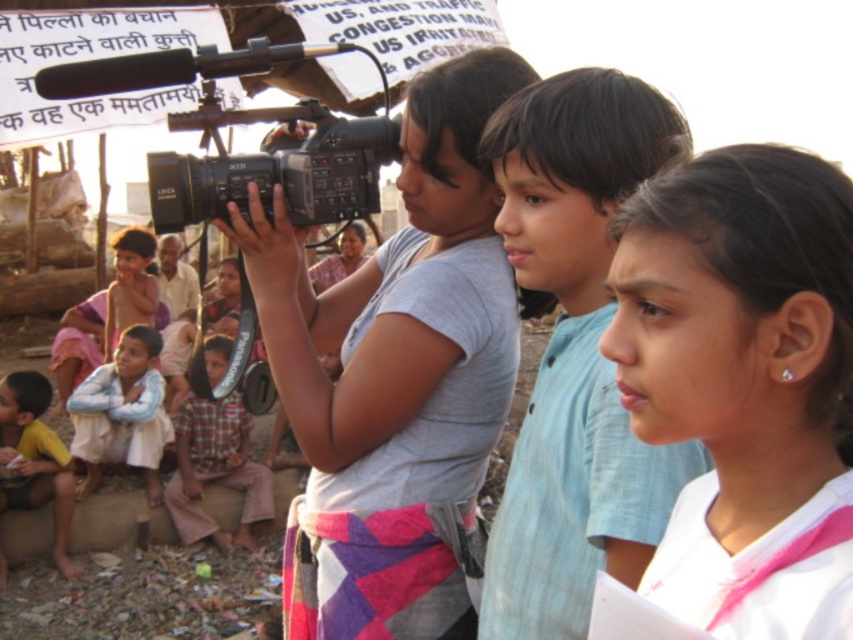
You are a photographer trying to capture a group photo of the children wearing the plaid fabric shirt at lower left and the yellow cotton shirt at lower left. Since you want to ensure both shirts are clearly visible in the photo, which shirt should you focus on first to make sure it fits within the frame?

The plaid fabric shirt at lower left is larger in size compared to the yellow cotton shirt at lower left, so you should focus on ensuring the plaid fabric shirt at lower left fits within the frame first to accommodate its larger size.

You are a photographer trying to capture a clear photo of the children in the scene. You notice two shirts at the lower left corner of your viewfinder. The plaid fabric shirt at lower left and the yellow cotton shirt at lower left. Which shirt should you adjust to ensure the other is visible?

The plaid fabric shirt at lower left is in front of the yellow cotton shirt at lower left. To make the yellow cotton shirt at lower left visible, you should adjust the plaid fabric shirt at lower left to move it out of the way.